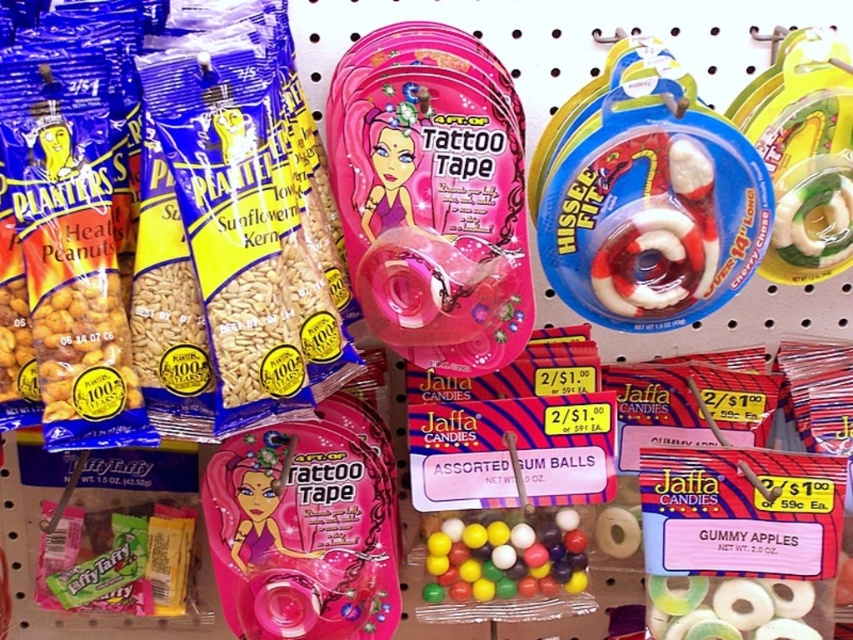
Which is behind, point (770, 193) or point (790, 616)?

Positioned behind is point (790, 616).

Who is higher up, white rubber ring at right or gummy translucent rings at center?

white rubber ring at right

Where is `white rubber ring at right`? This screenshot has width=853, height=640. white rubber ring at right is located at coordinates (646, 196).

At what (x,y) coordinates should I click in order to perform the action: click on white rubber ring at right. Please return your answer as a coordinate pair (x, y). The image size is (853, 640). Looking at the image, I should click on (646, 196).

Which of these two, translucent plastic toy at right or gummy translucent rings at center, stands shorter?

Standing shorter between the two is gummy translucent rings at center.

Between translucent plastic toy at right and gummy translucent rings at center, which one appears on the left side from the viewer's perspective?

From the viewer's perspective, gummy translucent rings at center appears more on the left side.

What do you see at coordinates (804, 154) in the screenshot?
I see `translucent plastic toy at right` at bounding box center [804, 154].

Where is `translucent plastic toy at right`? This screenshot has width=853, height=640. translucent plastic toy at right is located at coordinates (804, 154).

From the picture: Is pink plastic tattoo tape at center above glossy plastic gum balls at center?

Indeed, pink plastic tattoo tape at center is positioned over glossy plastic gum balls at center.

Is pink plastic tattoo tape at center below glossy plastic gum balls at center?

Incorrect, pink plastic tattoo tape at center is not positioned below glossy plastic gum balls at center.

Is point (505, 230) farther from viewer compared to point (563, 515)?

That is False.

Locate an element on the screen. This screenshot has width=853, height=640. pink plastic tattoo tape at center is located at coordinates (432, 195).